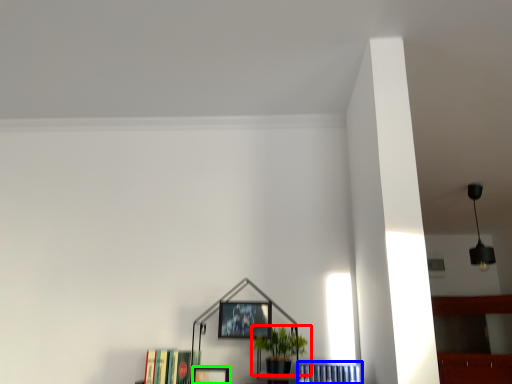
Question: Which is nearer to the houseplant (highlighted by a red box)? book (highlighted by a blue box) or picture frame (highlighted by a green box).

Choices:
 (A) book
 (B) picture frame

Answer: (A)